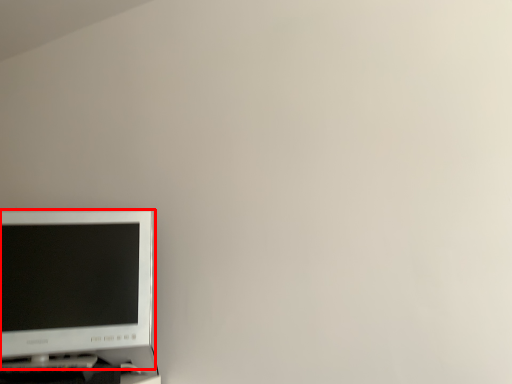
Question: From the image's perspective, where is computer monitor (annotated by the red box) located relative to computer desk?

Choices:
 (A) above
 (B) below

Answer: (A)